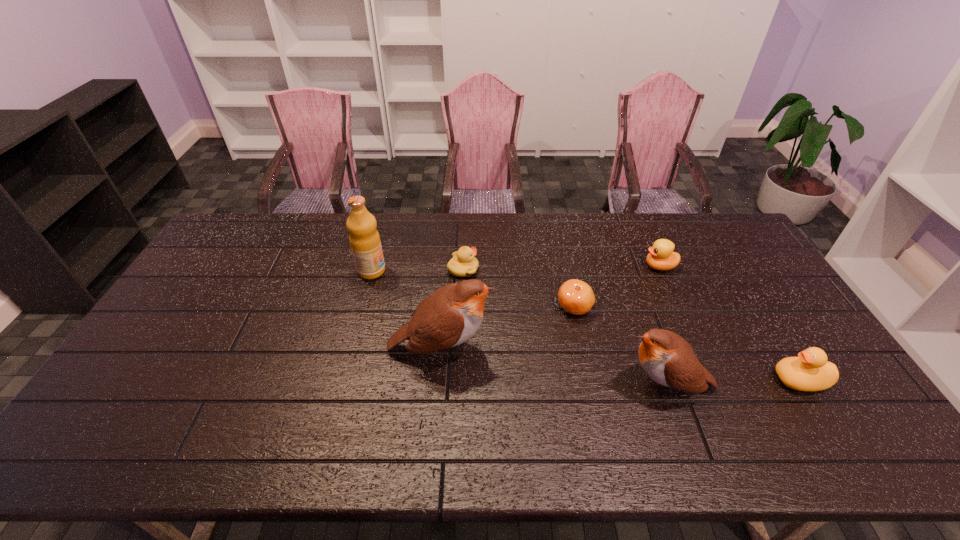
Where is `the left bird`? This screenshot has height=540, width=960. the left bird is located at coordinates (451, 315).

I want to click on the fifth shortest object, so click(x=668, y=359).

Identify the location of the right bird. This screenshot has height=540, width=960. (668, 359).

Where is `the right duckling`? The height and width of the screenshot is (540, 960). the right duckling is located at coordinates (661, 257).

Locate an element on the screen. fruit juice is located at coordinates (364, 239).

This screenshot has width=960, height=540. What are the coordinates of `clementine` in the screenshot? It's located at (576, 297).

What are the coordinates of `the fourth nearest object` in the screenshot? It's located at (576, 297).

Image resolution: width=960 pixels, height=540 pixels. Identify the location of the left duckling. (463, 264).

Where is `duck`? The image size is (960, 540). duck is located at coordinates (810, 371).

Locate an element on the screen. This screenshot has height=540, width=960. free spot located 0.290m at the face of the taller bird is located at coordinates (598, 349).